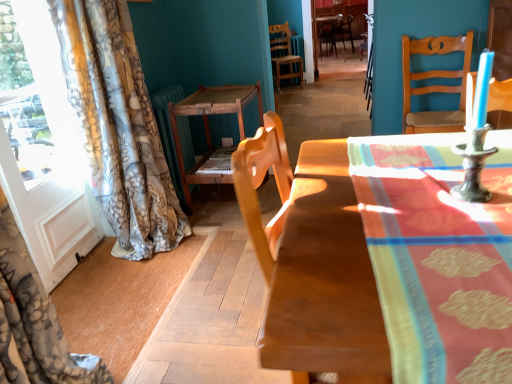
At what (x,y) coordinates should I click in order to perform the action: click on vacant space behind metallic candle holder at right. Please return your answer as a coordinate pair (x, y). Looking at the image, I should click on (420, 169).